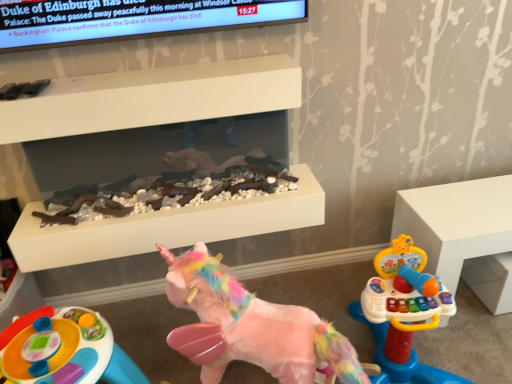
Question: Should I look upward or downward to see white plastic toy at right?

Choices:
 (A) down
 (B) up

Answer: (A)

Question: From a real-world perspective, is fluffy pink unicorn at center, which is the 1th toy from right to left, positioned over white plastic toy at right based on gravity?

Choices:
 (A) no
 (B) yes

Answer: (B)

Question: Is fluffy pink unicorn at center, positioned as the 2th toy in left-to-right order, at the right side of white plastic toy at right?

Choices:
 (A) no
 (B) yes

Answer: (A)

Question: From the image's perspective, is fluffy pink unicorn at center, which is the 1th toy from right to left, beneath white plastic toy at right?

Choices:
 (A) yes
 (B) no

Answer: (A)

Question: Does fluffy pink unicorn at center, which is the 1th toy from right to left, come behind white plastic toy at right?

Choices:
 (A) no
 (B) yes

Answer: (A)

Question: Is fluffy pink unicorn at center, which is the 1th toy from right to left, to the left of white plastic toy at right from the viewer's perspective?

Choices:
 (A) no
 (B) yes

Answer: (B)

Question: Can you confirm if fluffy pink unicorn at center, which is the 1th toy from right to left, is bigger than white plastic toy at right?

Choices:
 (A) no
 (B) yes

Answer: (B)

Question: Is plastic colorful activity table at lower left, the 2th toy when ordered from right to left, taller than white plastic toy at right?

Choices:
 (A) no
 (B) yes

Answer: (A)

Question: Is plastic colorful activity table at lower left, the 2th toy when ordered from right to left, surrounding white plastic toy at right?

Choices:
 (A) no
 (B) yes

Answer: (A)

Question: Is plastic colorful activity table at lower left, the first toy positioned from the left, at the left side of white plastic toy at right?

Choices:
 (A) yes
 (B) no

Answer: (A)

Question: Does plastic colorful activity table at lower left, the 2th toy when ordered from right to left, have a smaller size compared to white plastic toy at right?

Choices:
 (A) yes
 (B) no

Answer: (B)

Question: Considering the relative positions of plastic colorful activity table at lower left, the first toy positioned from the left, and white plastic toy at right in the image provided, is plastic colorful activity table at lower left, the first toy positioned from the left, behind white plastic toy at right?

Choices:
 (A) yes
 (B) no

Answer: (B)

Question: From a real-world perspective, is plastic colorful activity table at lower left, the 2th toy when ordered from right to left, on top of white plastic toy at right?

Choices:
 (A) yes
 (B) no

Answer: (B)

Question: Can you confirm if white plastic toy at right is smaller than white matte fireplace at upper center?

Choices:
 (A) yes
 (B) no

Answer: (B)